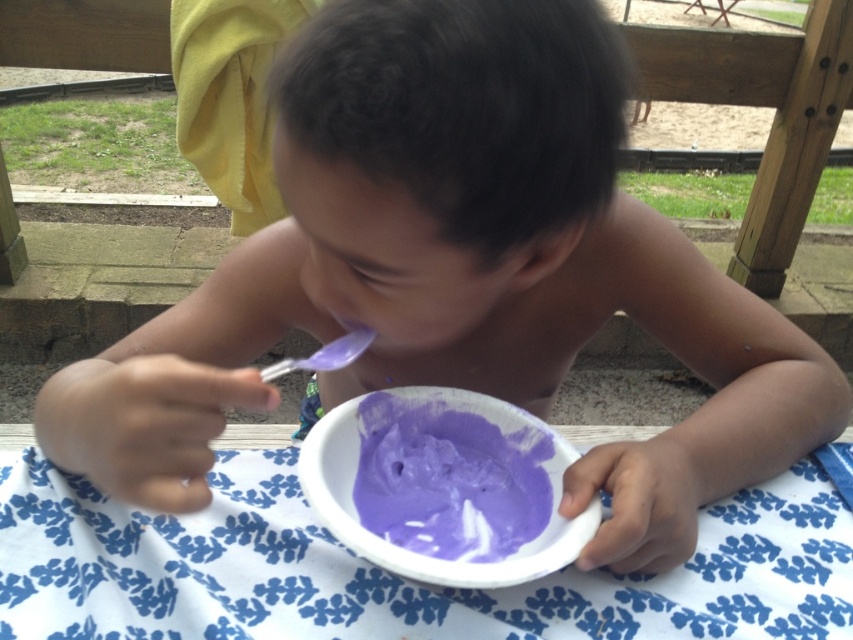
Is white fabric at center bigger than purple matte food at center?

Indeed, white fabric at center has a larger size compared to purple matte food at center.

Is white fabric at center to the right of purple matte food at center from the viewer's perspective?

Yes, white fabric at center is to the right of purple matte food at center.

Which is behind, point (637, 637) or point (405, 512)?

Positioned behind is point (405, 512).

You are a GUI agent. You are given a task and a screenshot of the screen. Output one action in this format:
    pyautogui.click(x=<x>, y=<y>)
    Task: Click on the white fabric at center
    Image resolution: width=853 pixels, height=640 pixels.
    Given the screenshot: What is the action you would take?
    pyautogui.click(x=384, y=572)

Which is more to the left, purple matte food at center or transparent plastic spoon at center?

From the viewer's perspective, transparent plastic spoon at center appears more on the left side.

Is point (492, 506) more distant than point (368, 330)?

That is True.

The width and height of the screenshot is (853, 640). Find the location of `purple matte food at center`. purple matte food at center is located at coordinates (450, 480).

Is white fabric at center taller than transparent plastic spoon at center?

Indeed, white fabric at center has a greater height compared to transparent plastic spoon at center.

Which is above, white fabric at center or transparent plastic spoon at center?

transparent plastic spoon at center is above.

Where is `white fabric at center`? white fabric at center is located at coordinates (384, 572).